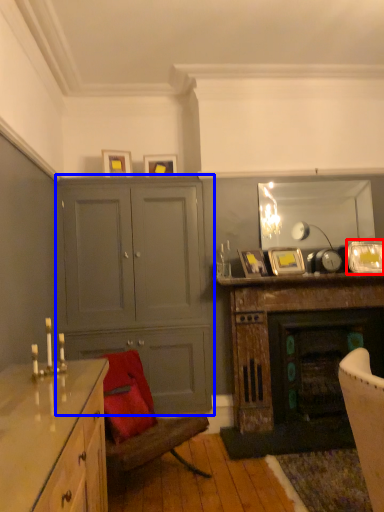
Question: Among these objects, which one is nearest to the camera, picture frame (highlighted by a red box) or cabinetry (highlighted by a blue box)?

Choices:
 (A) picture frame
 (B) cabinetry

Answer: (B)